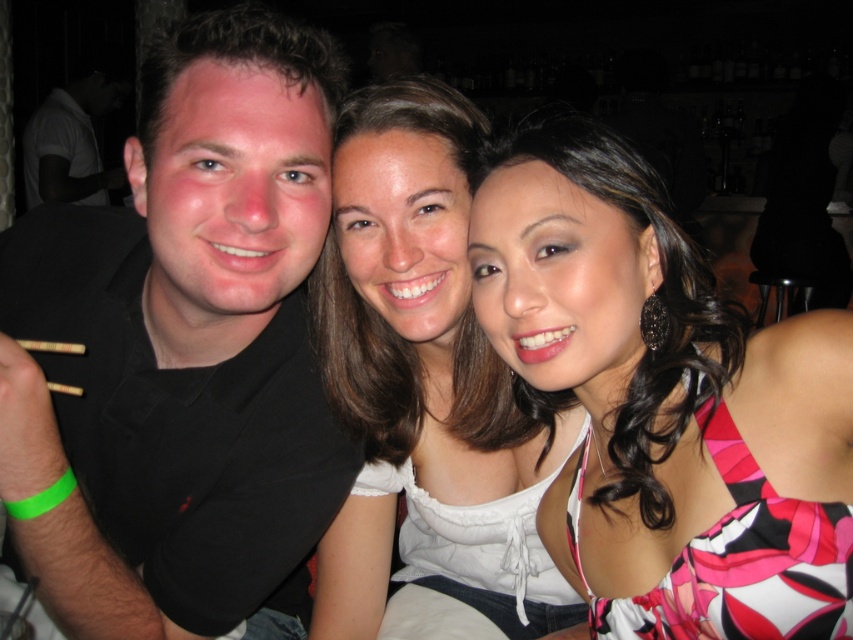
Is white satin blouse at center above white matte shirt at left?

Actually, white satin blouse at center is below white matte shirt at left.

Is point (369, 246) positioned in front of point (64, 99)?

Yes.

Identify the location of white satin blouse at center. (425, 394).

Is black shirt at left to the right of white satin blouse at center from the viewer's perspective?

Incorrect, black shirt at left is not on the right side of white satin blouse at center.

Is black shirt at left bigger than white satin blouse at center?

Correct, black shirt at left is larger in size than white satin blouse at center.

Identify the location of black shirt at left. This screenshot has height=640, width=853. (183, 348).

From the picture: Is printed fabric dress at center thinner than white satin blouse at center?

Correct, printed fabric dress at center's width is less than white satin blouse at center's.

Can you confirm if printed fabric dress at center is smaller than white satin blouse at center?

Indeed, printed fabric dress at center has a smaller size compared to white satin blouse at center.

Between point (643, 243) and point (379, 444), which one is positioned in front?

Point (643, 243) is more forward.

Identify the location of printed fabric dress at center. (664, 403).